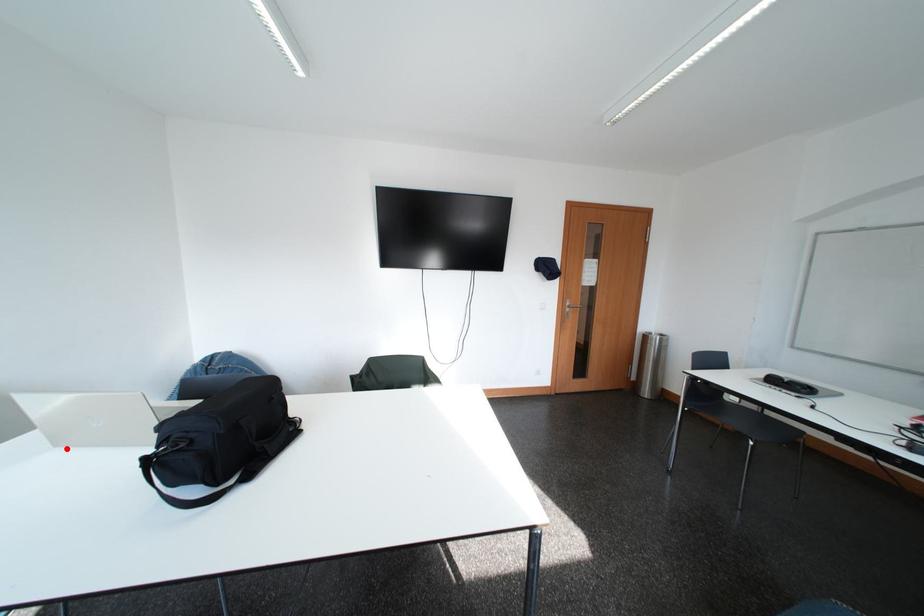
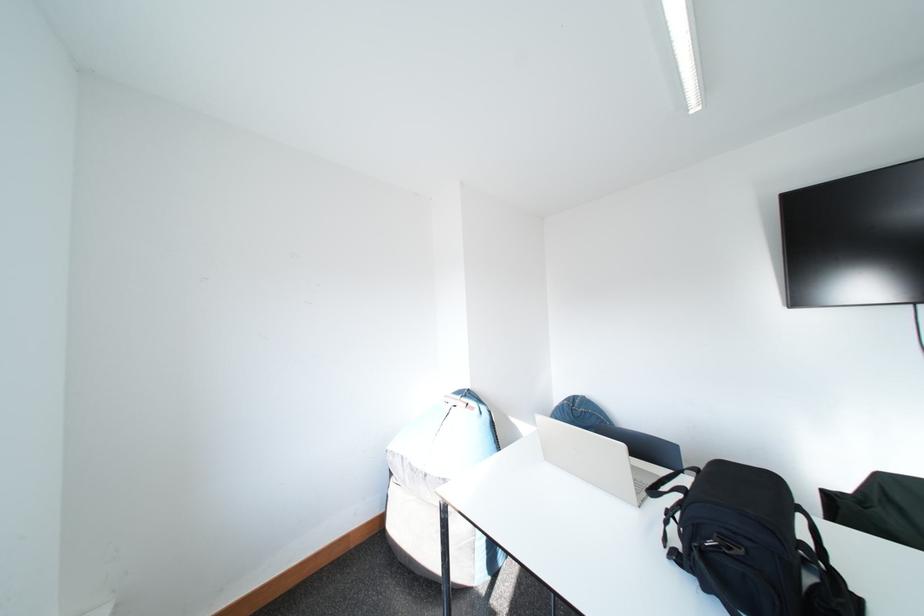
Question: I am providing you with two images of the same scene from different viewpoints. Given a red point in image1, look at the same physical point in image2. Is it:

Choices:
 (A) Closer to the viewpoint
 (B) Farther from the viewpoint

Answer: (B)